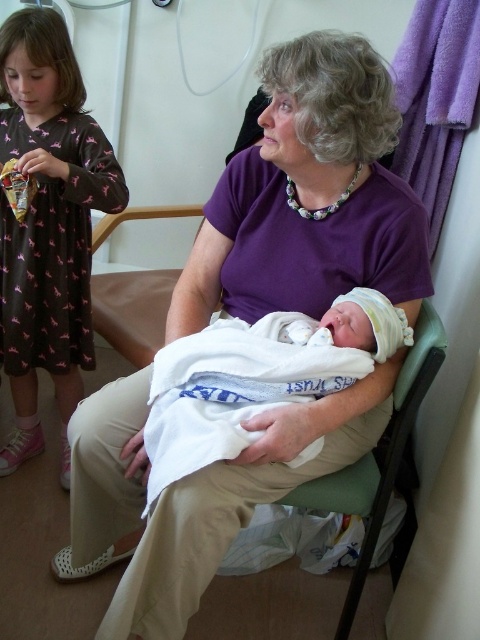
Question: Does brown cotton dress at left come in front of white soft blanket at center?

Choices:
 (A) no
 (B) yes

Answer: (A)

Question: Can you confirm if brown cotton dress at left is positioned to the left of white soft blanket at center?

Choices:
 (A) yes
 (B) no

Answer: (A)

Question: Which of the following is the farthest from the observer?

Choices:
 (A) (81, 93)
 (B) (362, 410)

Answer: (A)

Question: Is brown cotton dress at left to the right of white soft blanket at center from the viewer's perspective?

Choices:
 (A) no
 (B) yes

Answer: (A)

Question: Which of the following is the closest to the observer?

Choices:
 (A) brown cotton dress at left
 (B) white soft blanket at center

Answer: (B)